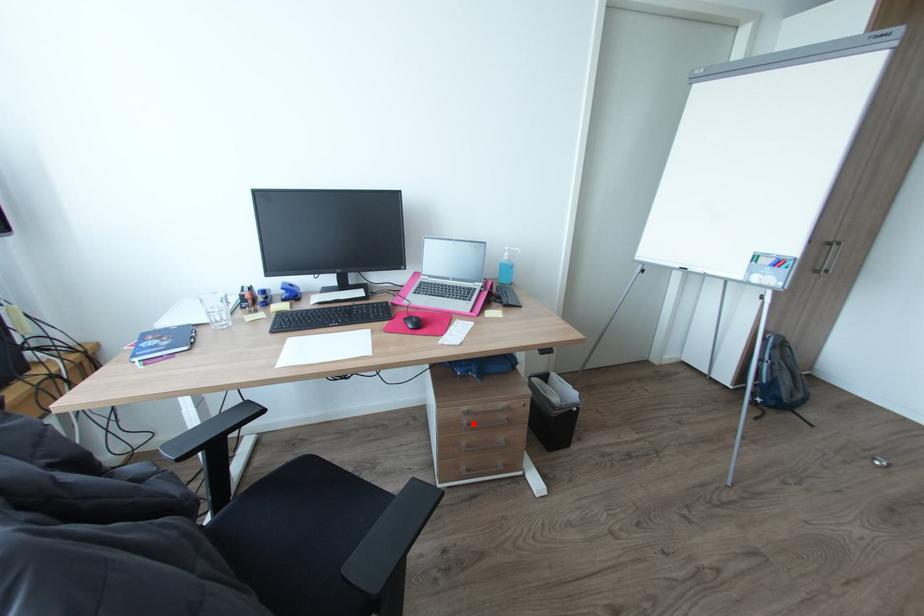
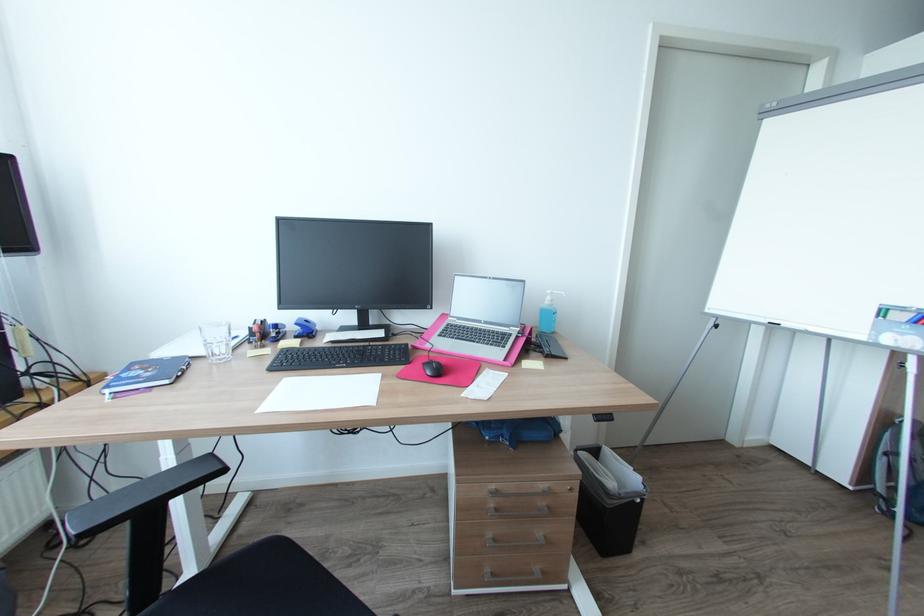
The point at the highlighted location is marked in the first image. Where is the corresponding point in the second image?

(501, 509)